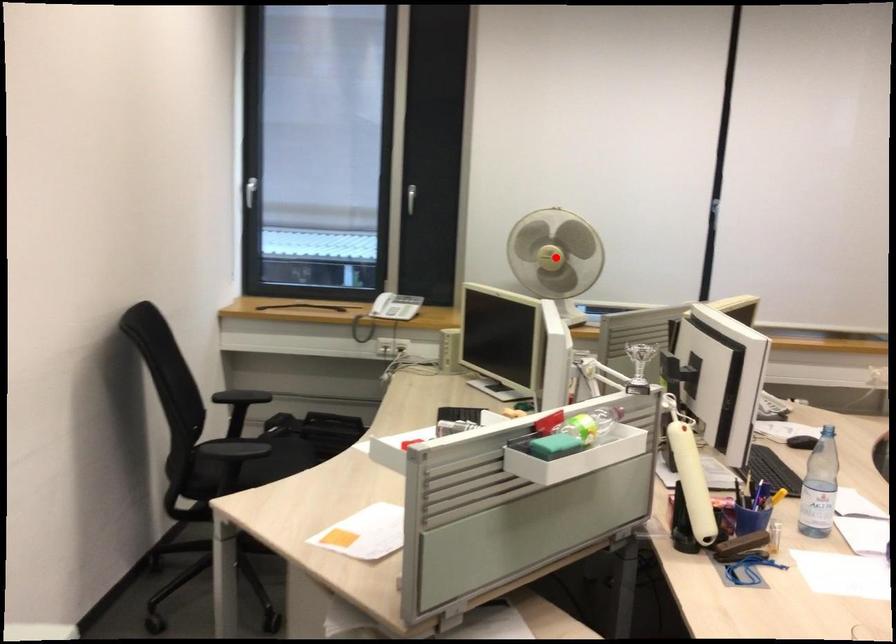
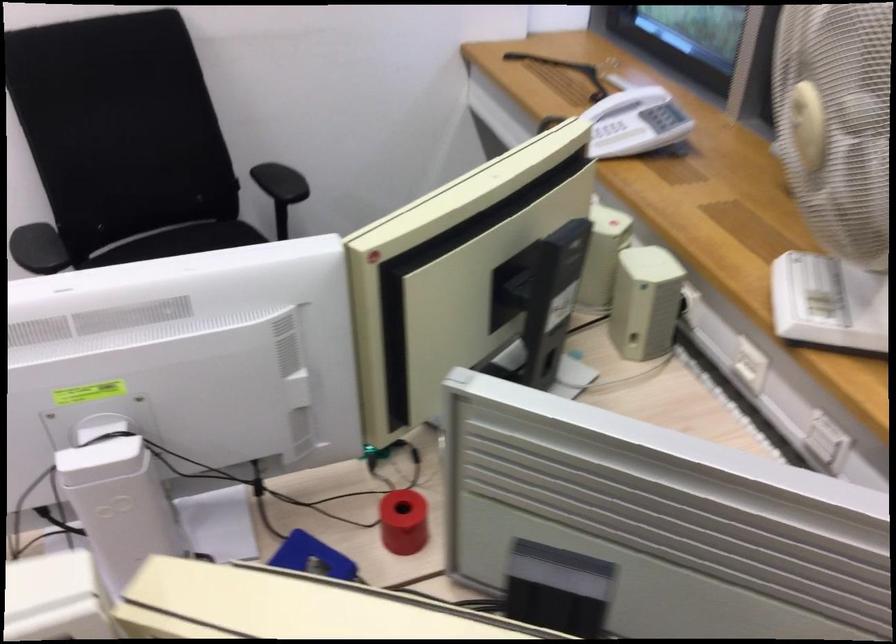
Question: I am providing you with two images of the same scene from different viewpoints. A red point is marked on the first image. Can you still see the location of the red point in image 2?

Choices:
 (A) Yes
 (B) No

Answer: (B)